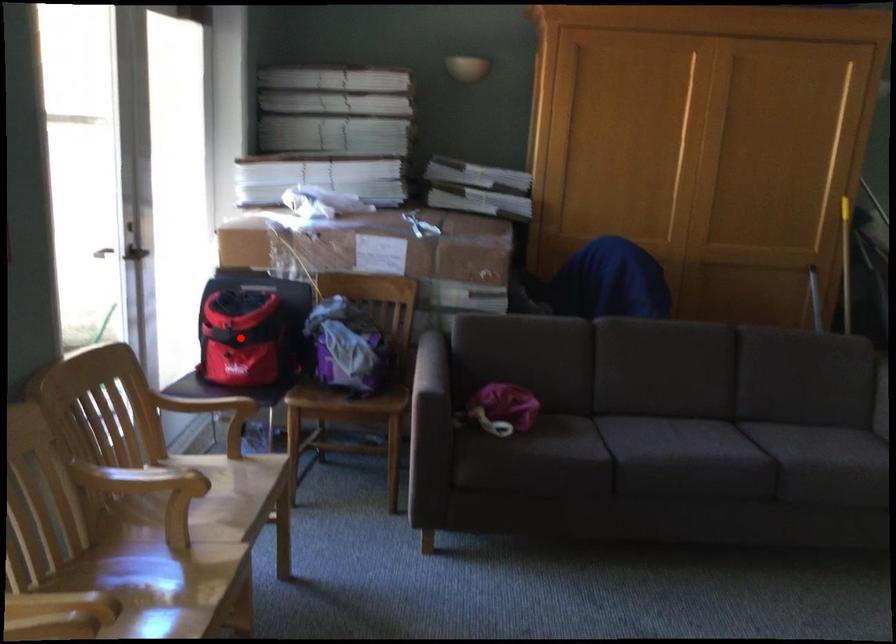
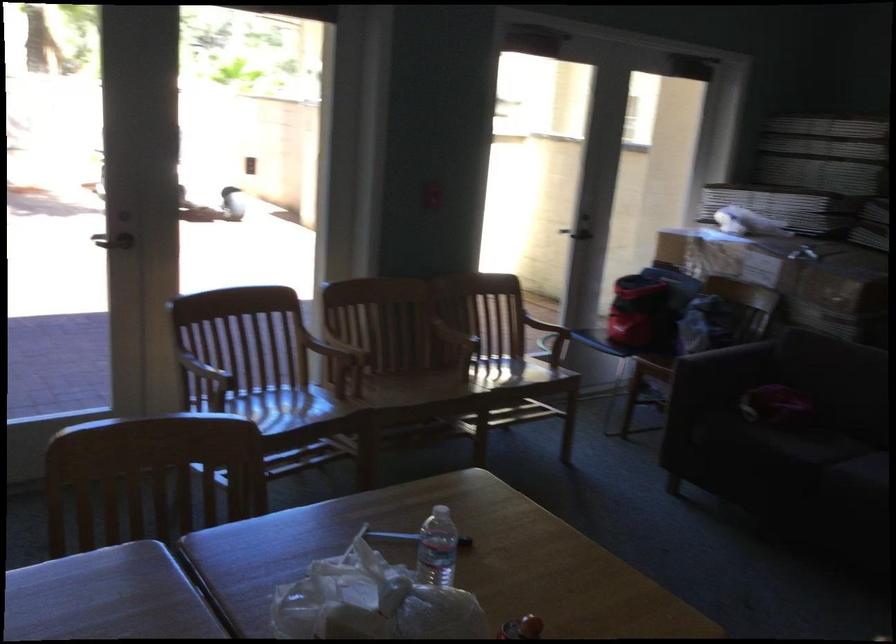
Question: I am providing you with two images of the same scene from different viewpoints. Given a red point in image1, look at the same physical point in image2. Is it:

Choices:
 (A) Closer to the viewpoint
 (B) Farther from the viewpoint

Answer: (B)